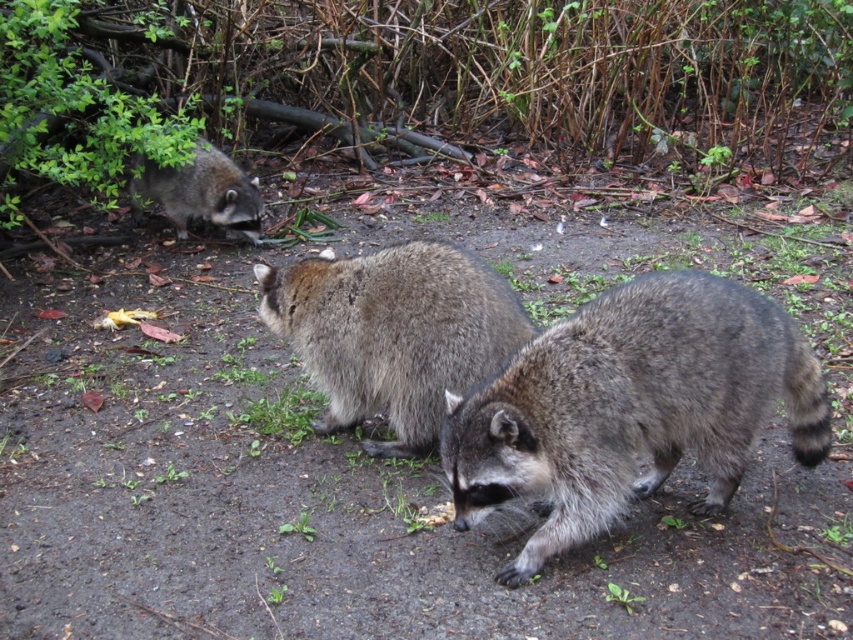
From the picture: Does fuzzy gray raccoon at center appear over fuzzy brown raccoon at center?

No, fuzzy gray raccoon at center is not above fuzzy brown raccoon at center.

Who is taller, fuzzy gray raccoon at center or fuzzy brown raccoon at center?

Standing taller between the two is fuzzy gray raccoon at center.

Is point (785, 342) in front of point (368, 285)?

Yes, point (785, 342) is closer to viewer.

Where is `fuzzy gray raccoon at center`? fuzzy gray raccoon at center is located at coordinates (630, 406).

Is fuzzy gray raccoon at center positioned behind fuzzy brown raccoon at upper left?

No, it is not.

Is fuzzy gray raccoon at center smaller than fuzzy brown raccoon at upper left?

Actually, fuzzy gray raccoon at center might be larger than fuzzy brown raccoon at upper left.

Which is in front, point (517, 353) or point (157, 186)?

Positioned in front is point (517, 353).

Find the location of `fuzzy gray raccoon at center`. fuzzy gray raccoon at center is located at coordinates (630, 406).

Does fuzzy brown raccoon at center appear on the left side of fuzzy brown raccoon at upper left?

Incorrect, fuzzy brown raccoon at center is not on the left side of fuzzy brown raccoon at upper left.

Who is positioned more to the left, fuzzy brown raccoon at center or fuzzy brown raccoon at upper left?

fuzzy brown raccoon at upper left is more to the left.

Who is more forward, (396, 298) or (223, 186)?

Point (396, 298)

Where is `fuzzy brown raccoon at center`? The width and height of the screenshot is (853, 640). fuzzy brown raccoon at center is located at coordinates (393, 332).